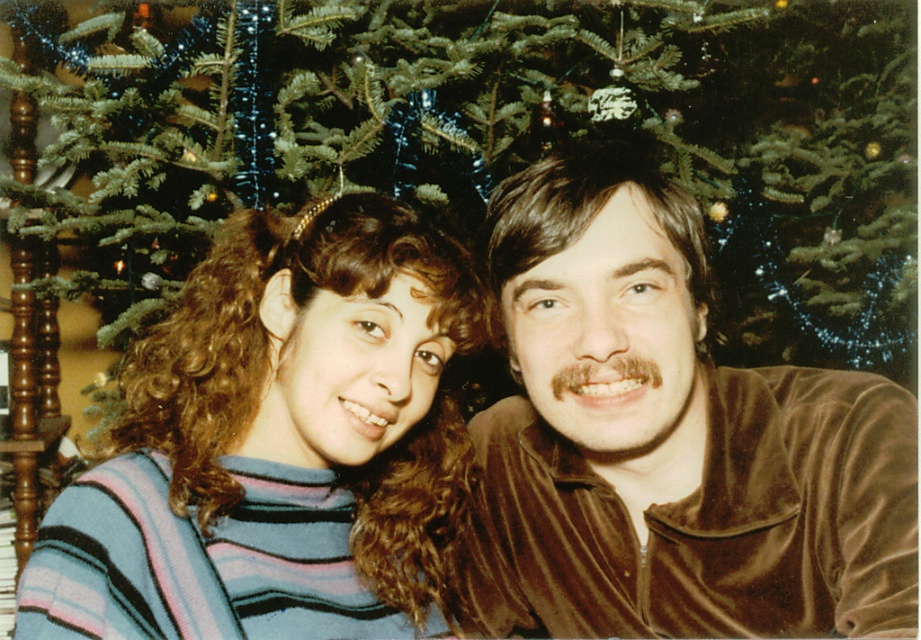
You are planning to take a photo of the green matte christmas tree at center and the striped sweater at center. Considering their sizes, which object should you focus on first to ensure both are in the frame?

The green matte christmas tree at center is wider than the striped sweater at center, so you should focus on the green matte christmas tree at center first to ensure both fit within the frame.

You are a photographer setting up a camera to take a photo of the green matte christmas tree at center and the velvet brown shirt at center. The camera requires at least 50 centimeters of space between subjects to focus properly. Is the current distance sufficient?

The distance between the green matte christmas tree at center and the velvet brown shirt at center is 74.01 centimeters, which is more than the required 50 centimeters. Therefore, the camera can focus properly on both subjects.

You are a photographer trying to capture a group photo of the two people in front of the Christmas tree. The velvet brown shirt at center and striped sweater at center are 6.94 inches apart. You need to ensure there is at least 8 inches between them for proper framing. Can they move closer together or farther apart to meet this requirement?

The velvet brown shirt at center and striped sweater at center are currently 6.94 inches apart, which is less than the required 8 inches. They need to move farther apart to meet the 8 inch requirement.